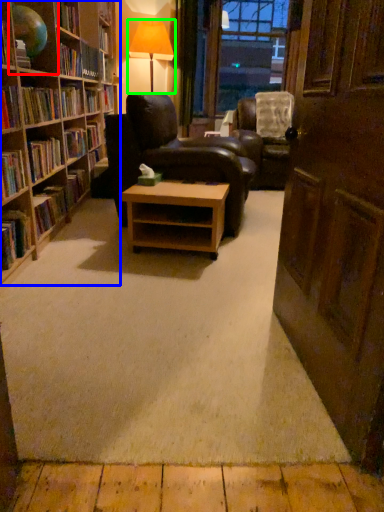
Question: Which object is the farthest from shelf (highlighted by a red box)? Choose among these: bookcase (highlighted by a blue box) or table lamp (highlighted by a green box).

Choices:
 (A) bookcase
 (B) table lamp

Answer: (B)